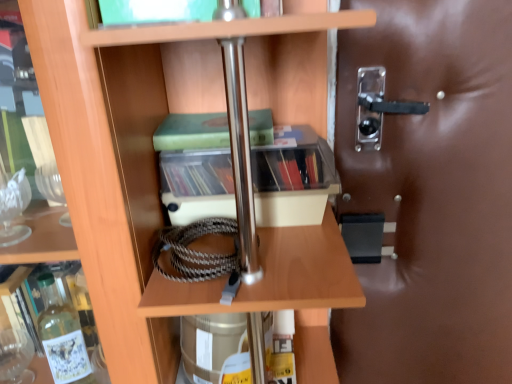
Question: Looking at their shapes, would you say green matte book at center is wider or thinner than transparent plastic handle at right?

Choices:
 (A) thin
 (B) wide

Answer: (B)

Question: Looking at the image, does green matte book at center seem bigger or smaller compared to transparent plastic handle at right?

Choices:
 (A) big
 (B) small

Answer: (B)

Question: Which object is positioned closest to the wooden shelf at center?

Choices:
 (A) transparent plastic handle at right
 (B) green matte book at center
 (C) clear plastic storage at center

Answer: (C)

Question: Which object is the farthest from the transparent plastic handle at right?

Choices:
 (A) clear plastic storage at center
 (B) green matte book at center
 (C) wooden shelf at center

Answer: (B)